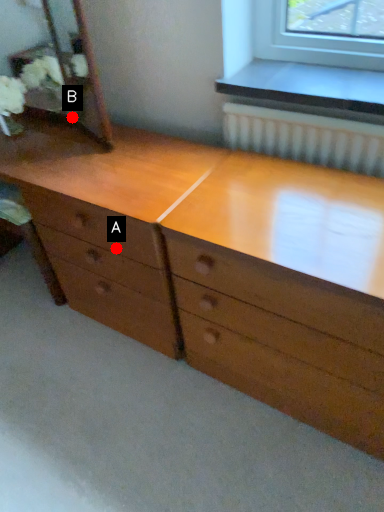
Question: Two points are circled on the image, labeled by A and B beside each circle. Which point appears closest to the camera in this image?

Choices:
 (A) A is closer
 (B) B is closer

Answer: (A)